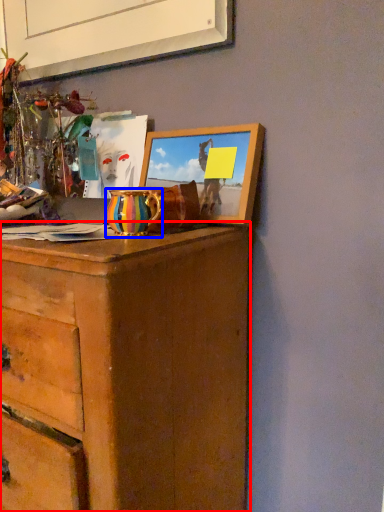
Question: Which object appears farthest to the camera in this image, chest of drawers (highlighted by a red box) or vase (highlighted by a blue box)?

Choices:
 (A) chest of drawers
 (B) vase

Answer: (B)